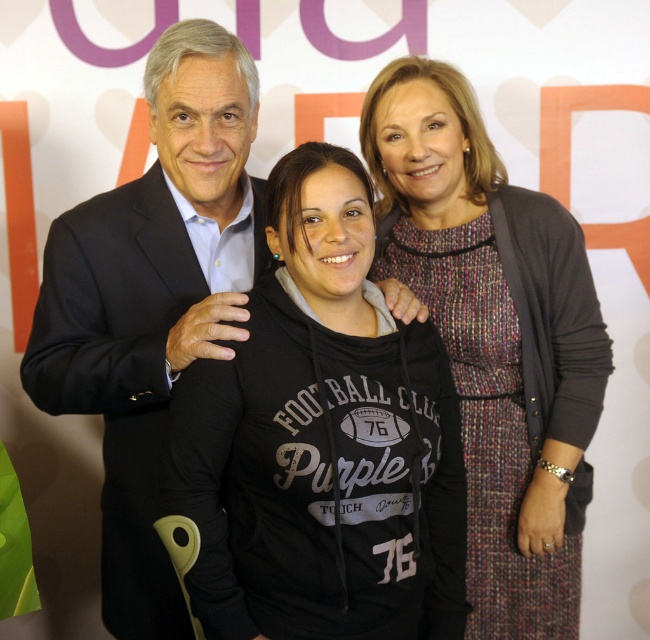
Measure the distance between black hoodie at center and camera.

They are 1.06 meters apart.

Identify the location of black hoodie at center. Image resolution: width=650 pixels, height=640 pixels. (322, 440).

Is knitted sweater at center taller than dark suit at center?

Yes.

In the scene shown: Can you confirm if knitted sweater at center is positioned below dark suit at center?

Yes, knitted sweater at center is below dark suit at center.

Measure the distance between knitted sweater at center and camera.

knitted sweater at center and camera are 4.55 feet apart.

Where is `knitted sweater at center`? This screenshot has height=640, width=650. knitted sweater at center is located at coordinates (495, 339).

Based on the photo, can you confirm if black hoodie at center is thinner than dark suit at center?

No, black hoodie at center is not thinner than dark suit at center.

Which of these two, black hoodie at center or dark suit at center, stands shorter?

Standing shorter between the two is black hoodie at center.

I want to click on black hoodie at center, so click(322, 440).